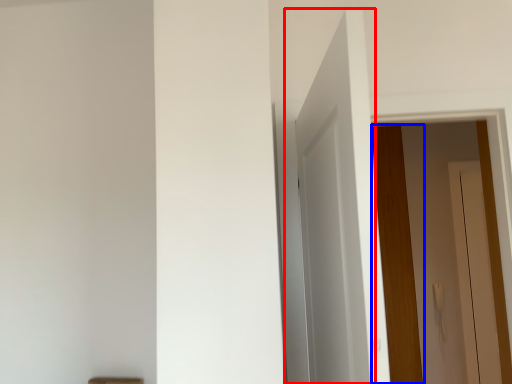
Question: Which object appears closest to the camera in this image, door (highlighted by a red box) or door (highlighted by a blue box)?

Choices:
 (A) door
 (B) door

Answer: (A)